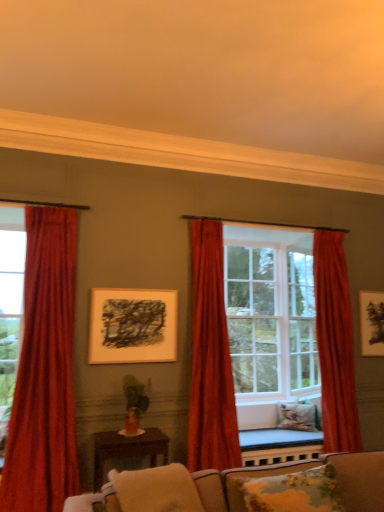
Question: Considering the relative sizes of velvet red curtain at center, which is counted as the second curtain, starting from the left, and fluffy beige pillow at lower center, which ranks as the third pillow in back-to-front order, in the image provided, is velvet red curtain at center, which is counted as the second curtain, starting from the left, smaller than fluffy beige pillow at lower center, which ranks as the third pillow in back-to-front order,?

Choices:
 (A) no
 (B) yes

Answer: (A)

Question: Does velvet red curtain at center, positioned as the second curtain in right-to-left order, contain fluffy beige pillow at lower center, positioned as the first pillow in front-to-back order?

Choices:
 (A) no
 (B) yes

Answer: (A)

Question: From the image's perspective, would you say velvet red curtain at center, which is counted as the second curtain, starting from the left, is shown under fluffy beige pillow at lower center, positioned as the first pillow in front-to-back order?

Choices:
 (A) yes
 (B) no

Answer: (B)

Question: Does velvet red curtain at center, which is counted as the second curtain, starting from the left, have a lesser width compared to fluffy beige pillow at lower center, marked as the third pillow in a right-to-left arrangement?

Choices:
 (A) no
 (B) yes

Answer: (B)

Question: Does velvet red curtain at center, which is counted as the second curtain, starting from the left, lie behind fluffy beige pillow at lower center, marked as the third pillow in a right-to-left arrangement?

Choices:
 (A) yes
 (B) no

Answer: (A)

Question: Is velvet red curtain at center, positioned as the second curtain in right-to-left order, not within fluffy beige pillow at lower center, marked as the third pillow in a right-to-left arrangement?

Choices:
 (A) yes
 (B) no

Answer: (A)

Question: Can you confirm if matte black picture frame at upper right, the 2th picture frame viewed from the front, is thinner than clear glass window at center?

Choices:
 (A) no
 (B) yes

Answer: (B)

Question: From the image's perspective, is matte black picture frame at upper right, the 2th picture frame viewed from the front, on clear glass window at center?

Choices:
 (A) no
 (B) yes

Answer: (B)

Question: Does matte black picture frame at upper right, the 2th picture frame viewed from the front, have a greater width compared to clear glass window at center?

Choices:
 (A) no
 (B) yes

Answer: (A)

Question: From a real-world perspective, is matte black picture frame at upper right, the 2th picture frame viewed from the front, located higher than clear glass window at center?

Choices:
 (A) yes
 (B) no

Answer: (A)

Question: Is matte black picture frame at upper right, marked as the first picture frame in a back-to-front arrangement, not near clear glass window at center?

Choices:
 (A) no
 (B) yes

Answer: (B)

Question: From a real-world perspective, is matte black picture frame at upper right, marked as the first picture frame in a back-to-front arrangement, located beneath clear glass window at center?

Choices:
 (A) no
 (B) yes

Answer: (A)

Question: Does brown wooden table at center have a greater height compared to clear glass door at center, which appears as the 1th glass door when viewed from the right?

Choices:
 (A) no
 (B) yes

Answer: (A)